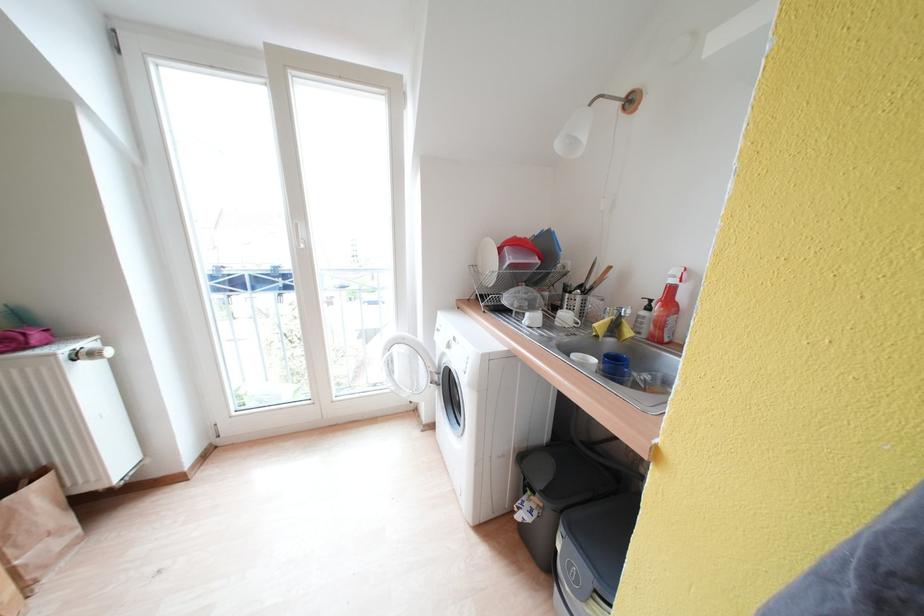
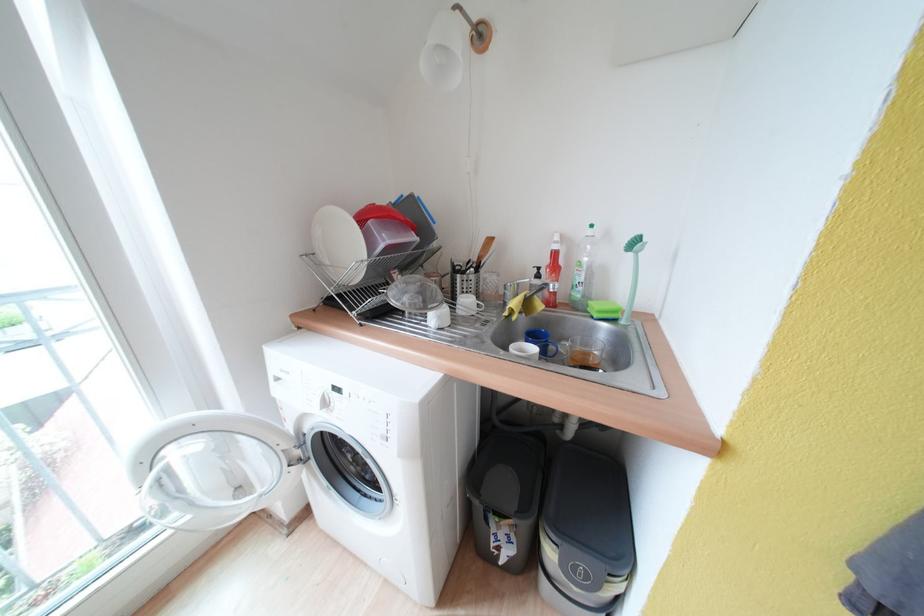
Question: The camera is either moving clockwise (left) or counter-clockwise (right) around the object. The first image is from the beginning of the video and the second image is from the end. Is the camera moving left or right when shooting the video?

Choices:
 (A) Left
 (B) Right

Answer: (A)